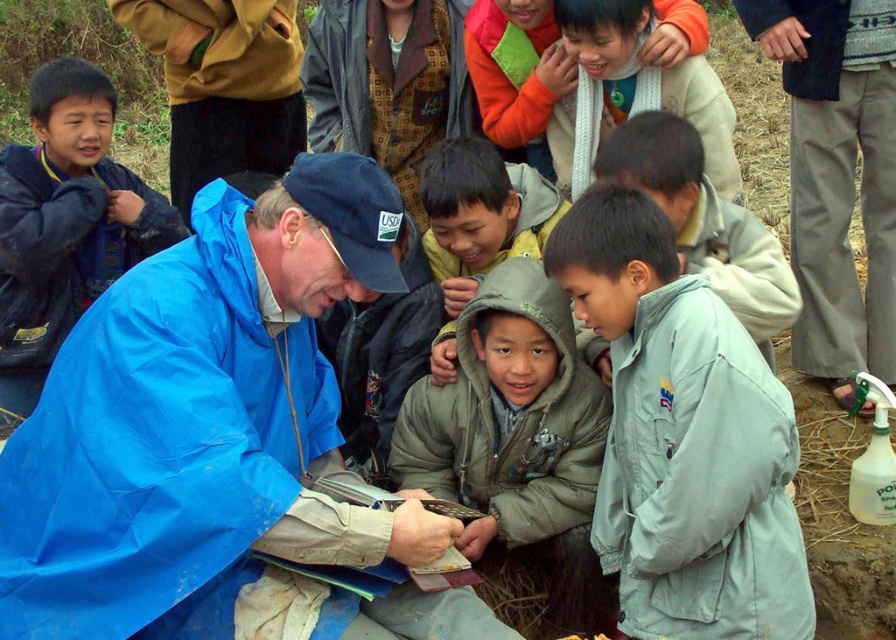
Measure the distance from blue waterproof jacket at left to gray matte jacket at center.

The distance of blue waterproof jacket at left from gray matte jacket at center is 2.30 meters.

Is blue waterproof jacket at left further to camera compared to gray matte jacket at center?

Yes, blue waterproof jacket at left is further from the viewer.

Which is behind, point (257, 164) or point (781, 314)?

The point (257, 164) is behind.

At what (x,y) coordinates should I click in order to perform the action: click on blue waterproof jacket at left. Please return your answer as a coordinate pair (x, y). The width and height of the screenshot is (896, 640). Looking at the image, I should click on (224, 84).

Who is positioned more to the left, blue waterproof jacket at center or orange fleece jacket at upper center?

From the viewer's perspective, blue waterproof jacket at center appears more on the left side.

Between point (54, 403) and point (481, 93), which one is positioned behind?

Point (481, 93)

Find the location of `blue waterproof jacket at center`. blue waterproof jacket at center is located at coordinates (220, 442).

Is gray fuzzy jacket at center further to the viewer compared to light gray hooded jacket at center?

No, it is in front of light gray hooded jacket at center.

Does point (490, 432) come closer to viewer compared to point (438, 202)?

Yes.

Is point (511, 483) positioned in front of point (445, 202)?

That is True.

At what (x,y) coordinates should I click in order to perform the action: click on gray fuzzy jacket at center. Please return your answer as a coordinate pair (x, y). Looking at the image, I should click on coord(517,449).